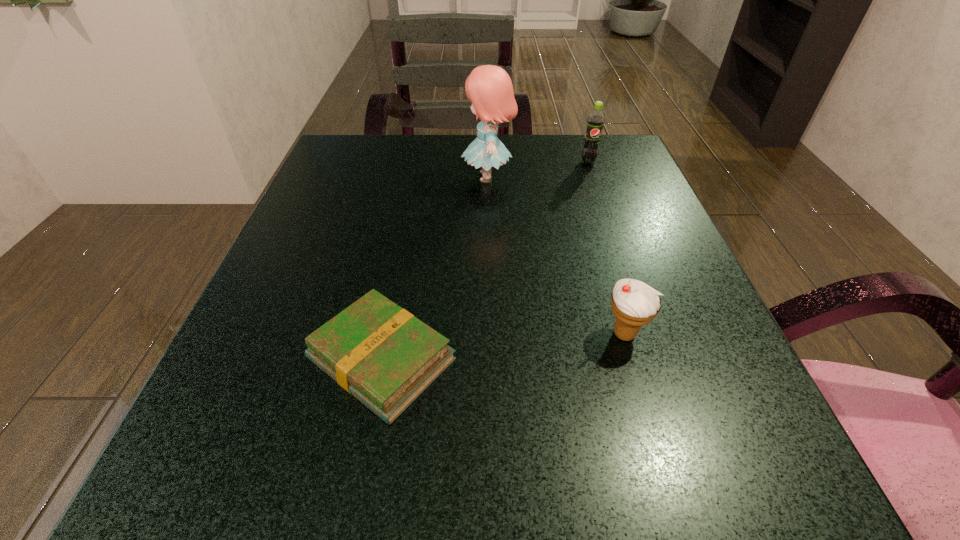
Image resolution: width=960 pixels, height=540 pixels. In the image, there is a desktop. What are the coordinates of `vacant space at the far left corner` in the screenshot? It's located at point(313,183).

Where is `free space at the near left corner of the desktop`? free space at the near left corner of the desktop is located at coordinates (267, 439).

Image resolution: width=960 pixels, height=540 pixels. Find the location of `blank space at the far right corner of the desktop`. blank space at the far right corner of the desktop is located at coordinates (568, 168).

Identify the location of free space at the near right corner of the desktop. point(728,480).

At what (x,y) coordinates should I click in order to perform the action: click on vacant area between the tallest object and the shortest object. Please return your answer as a coordinate pair (x, y). Image resolution: width=960 pixels, height=540 pixels. Looking at the image, I should click on (435, 268).

At what (x,y) coordinates should I click in order to perform the action: click on free space between the second shortest object and the book. Please return your answer as a coordinate pair (x, y). The height and width of the screenshot is (540, 960). Looking at the image, I should click on (503, 347).

The height and width of the screenshot is (540, 960). I want to click on free spot between the shortest object and the second tallest object, so pyautogui.click(x=485, y=261).

This screenshot has height=540, width=960. I want to click on vacant space in between the doll and the icecream, so click(x=556, y=255).

Where is `free space that is in between the doll and the soda`? This screenshot has width=960, height=540. free space that is in between the doll and the soda is located at coordinates (538, 170).

Locate an element on the screen. The width and height of the screenshot is (960, 540). vacant region between the third tallest object and the soda is located at coordinates (607, 248).